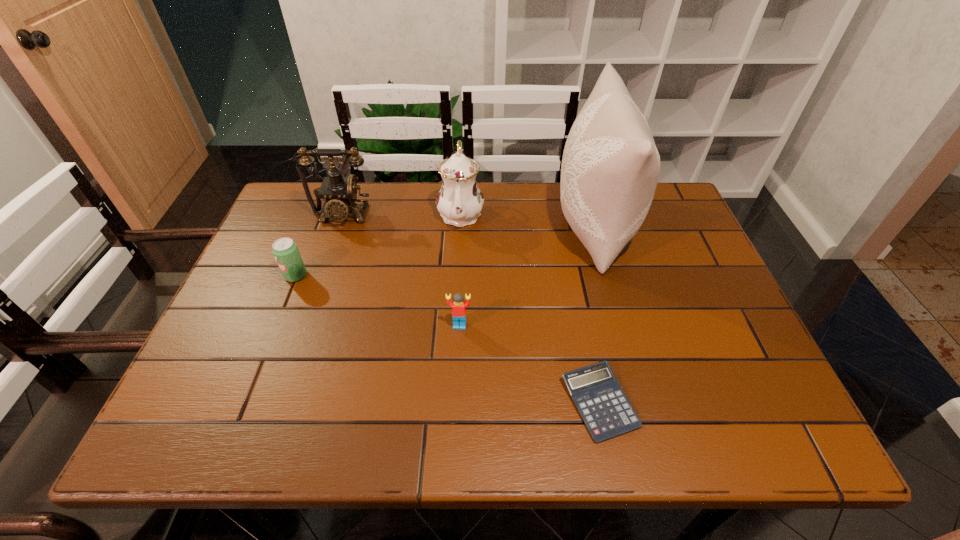
You are a GUI agent. You are given a task and a screenshot of the screen. Output one action in this format:
    pyautogui.click(x=<x>, y=<y>)
    Task: Click on the cushion
    
    Given the screenshot: What is the action you would take?
    pyautogui.click(x=610, y=167)

Identify the location of telephone. This screenshot has width=960, height=540. pos(340,193).

The image size is (960, 540). I want to click on chinaware, so click(x=459, y=201).

You are a GUI agent. You are given a task and a screenshot of the screen. Output one action in this format:
    pyautogui.click(x=<x>, y=<y>)
    Task: Click on the soda
    This screenshot has width=960, height=540.
    Given the screenshot: What is the action you would take?
    pyautogui.click(x=285, y=250)

Image resolution: width=960 pixels, height=540 pixels. I want to click on Lego, so click(459, 306).

Image resolution: width=960 pixels, height=540 pixels. What are the coordinates of `the nearest object` in the screenshot? It's located at (606, 411).

Where is `calculator`? calculator is located at coordinates (606, 411).

Identify the location of blank space located 0.080m on the front side of the tallest object. (526, 226).

This screenshot has height=540, width=960. In order to click on free space located on the front side of the tallest object in this screenshot , I will do `click(491, 226)`.

In order to click on blank space located on the front side of the tallest object in this screenshot , I will do `click(444, 226)`.